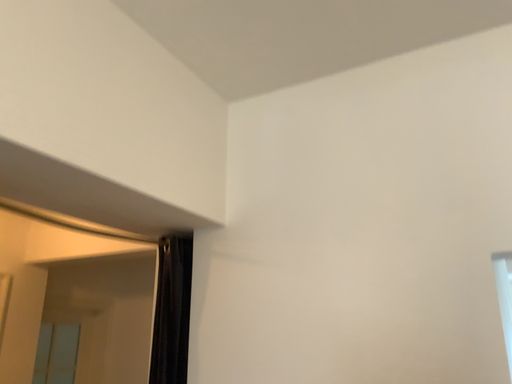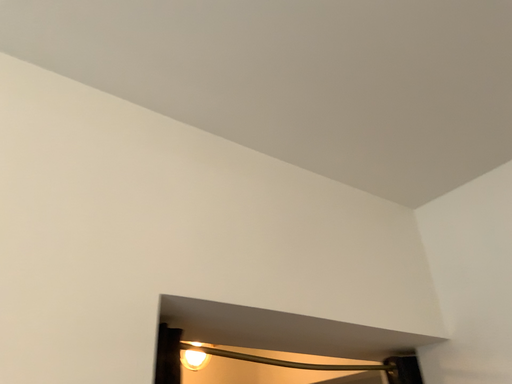
Question: Which way did the camera rotate in the video?

Choices:
 (A) rotated left
 (B) rotated right

Answer: (A)